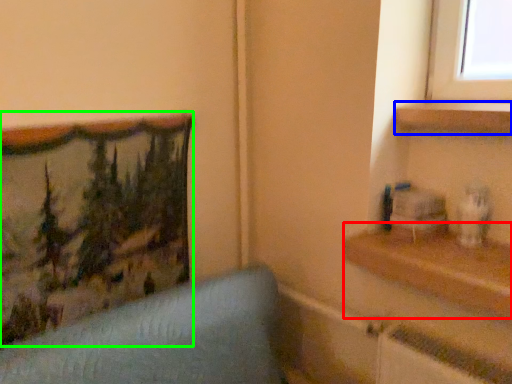
Question: Which object is the farthest from shelf (highlighted by a red box)? Choose among these: shelf (highlighted by a blue box) or picture frame (highlighted by a green box).

Choices:
 (A) shelf
 (B) picture frame

Answer: (B)